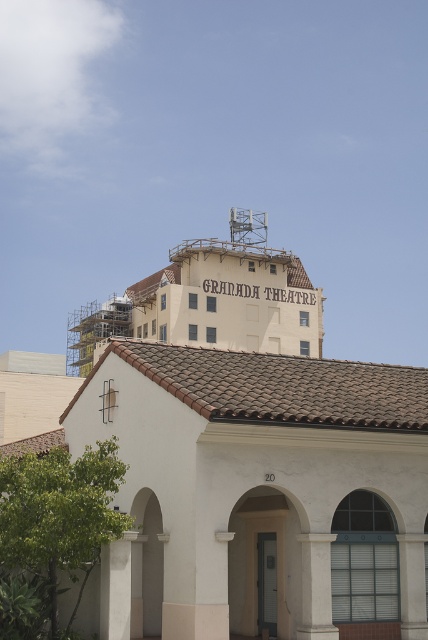
Is white stone column at center shorter than white concrete pillar at lower left?

Indeed, white stone column at center has a lesser height compared to white concrete pillar at lower left.

Which is in front, point (303, 561) or point (122, 561)?

Point (122, 561) is in front.

This screenshot has height=640, width=428. Describe the element at coordinates (315, 588) in the screenshot. I see `white stone column at center` at that location.

I want to click on white stone column at center, so click(x=315, y=588).